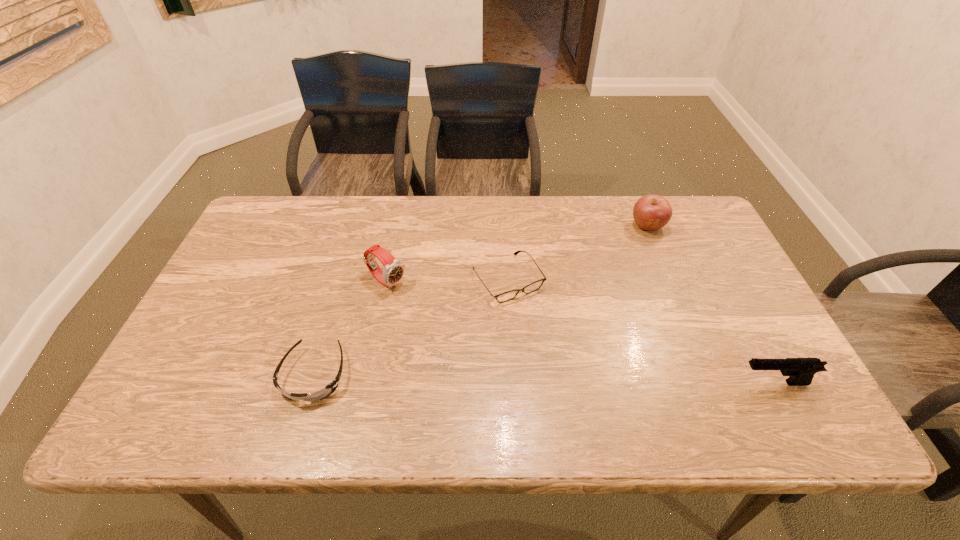
Where is `apple situated at the right edge`? Image resolution: width=960 pixels, height=540 pixels. apple situated at the right edge is located at coordinates (651, 212).

Locate an element on the screen. This screenshot has height=540, width=960. object located at the far right corner is located at coordinates (651, 212).

Locate an element on the screen. This screenshot has height=540, width=960. object positioned at the near right corner is located at coordinates (801, 371).

I want to click on free space at the far edge, so click(506, 226).

At what (x,y) coordinates should I click in order to perform the action: click on blank space at the near edge of the desktop. Please return your answer as a coordinate pair (x, y). This screenshot has width=960, height=540. Looking at the image, I should click on (278, 393).

Image resolution: width=960 pixels, height=540 pixels. In order to click on free region at the left edge of the desktop in this screenshot , I will do `click(245, 257)`.

The width and height of the screenshot is (960, 540). In the image, there is a desktop. Identify the location of free region at the right edge. (680, 251).

Identify the location of free space at the far left corner of the desktop. Image resolution: width=960 pixels, height=540 pixels. (309, 212).

This screenshot has width=960, height=540. What are the coordinates of `vacant space at the near left corner of the desktop` in the screenshot? It's located at (223, 381).

I want to click on vacant space at the near right corner, so click(x=725, y=370).